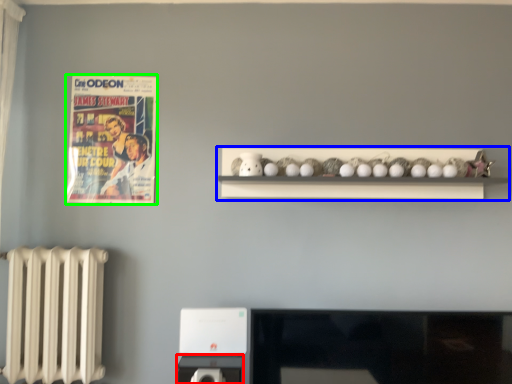
Question: Estimate the real-world distances between objects in this image. Which object is farther from appliance (highlighted by a red box), shelf (highlighted by a blue box) or comic book (highlighted by a green box)?

Choices:
 (A) shelf
 (B) comic book

Answer: (B)